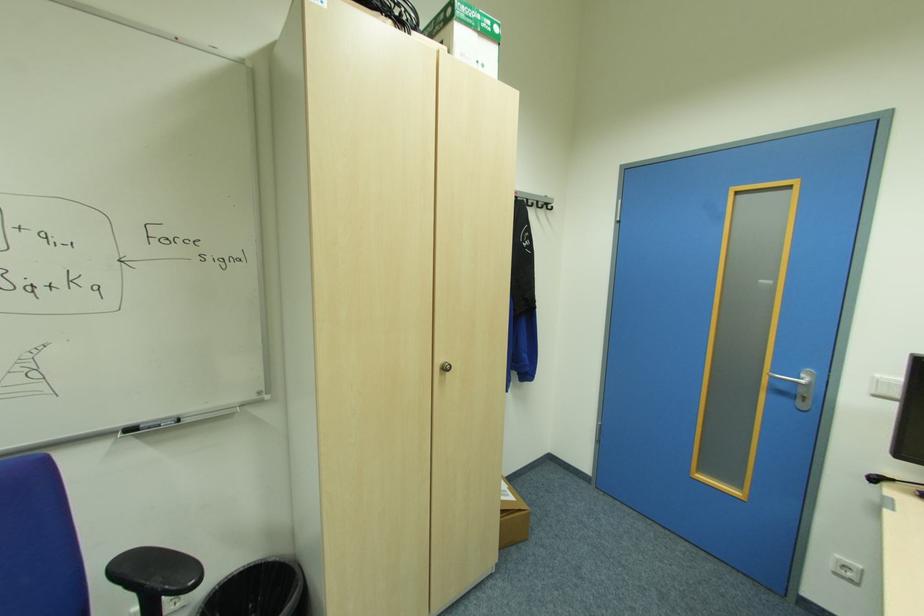
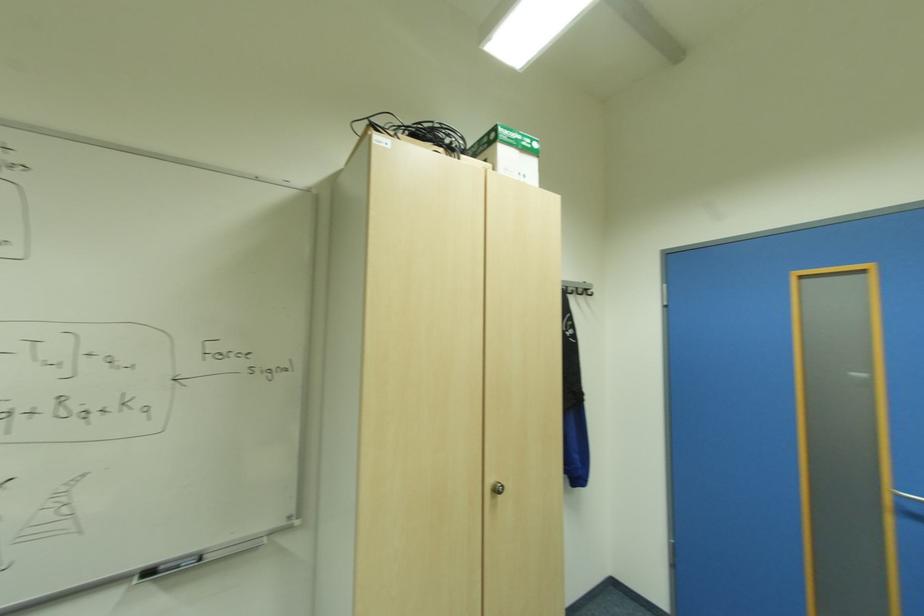
In a continuous first-person perspective shot, in which direction is the camera moving?

The cameraman walked toward left, forward.